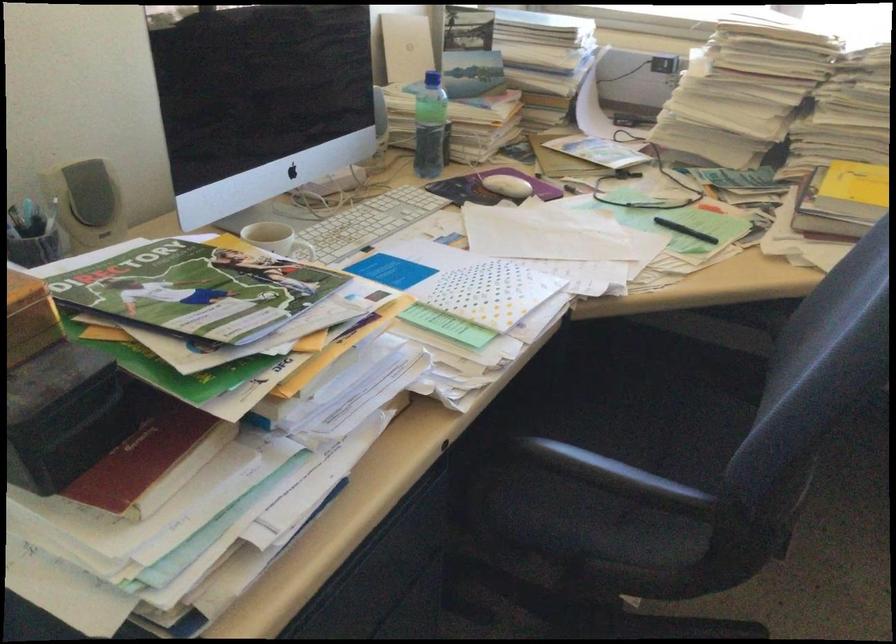
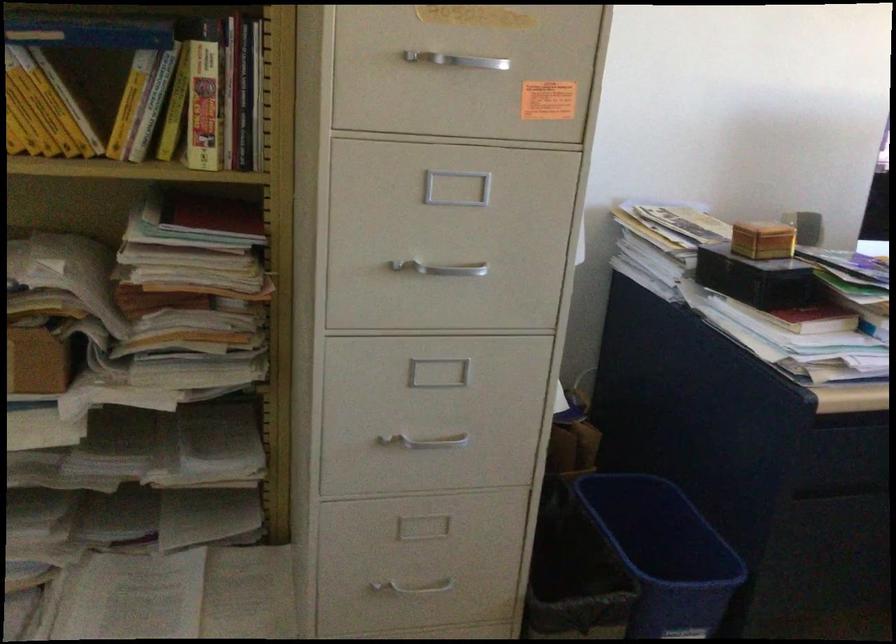
Question: Based on the continuous images, in which direction is the camera rotating? Reply with the corresponding letter.

Choices:
 (A) Left
 (B) Right
 (C) Up
 (D) Down

Answer: (A)